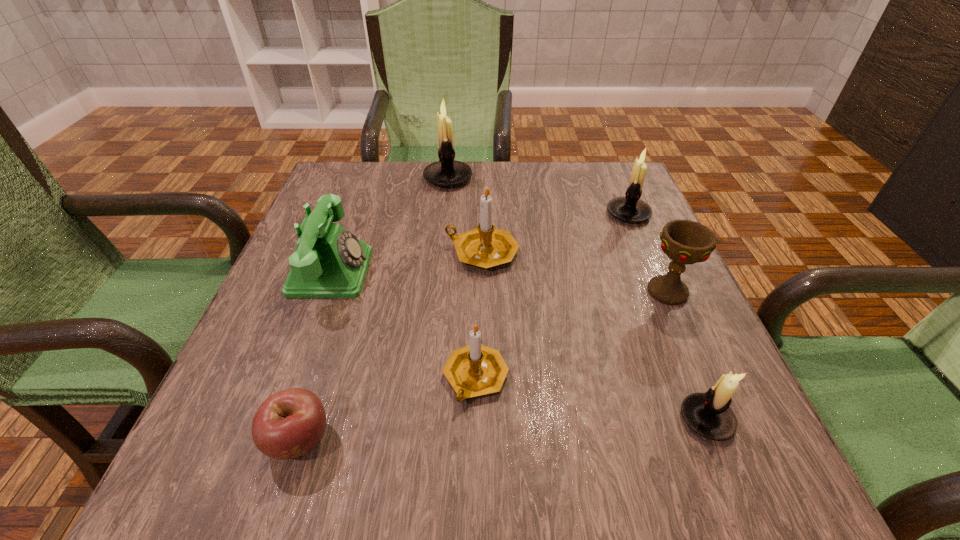
I want to click on the leftmost white candle holder, so click(446, 172).

Locate an element on the screen. This screenshot has height=540, width=960. the tallest object is located at coordinates click(x=446, y=172).

At what (x,y) coordinates should I click in order to perform the action: click on the second farthest white candle holder. Please return your answer as a coordinate pair (x, y). The height and width of the screenshot is (540, 960). Looking at the image, I should click on tap(630, 208).

I want to click on the seventh nearest object, so click(630, 208).

You are a GUI agent. You are given a task and a screenshot of the screen. Output one action in this format:
    pyautogui.click(x=<x>, y=<y>)
    Task: Click on the farther gold candle holder
    Image resolution: width=960 pixels, height=540 pixels.
    Given the screenshot: What is the action you would take?
    pyautogui.click(x=485, y=246)

Image resolution: width=960 pixels, height=540 pixels. What are the coordinates of `the bigger gold candle holder` in the screenshot? It's located at (485, 246).

Identify the location of green telephone. (329, 262).

Locate an element on the screen. This screenshot has height=540, width=960. chalice is located at coordinates click(684, 241).

Find the location of a particular element. the smaller gold candle holder is located at coordinates (474, 370).

Identify the location of the smallest white candle holder. (708, 414).